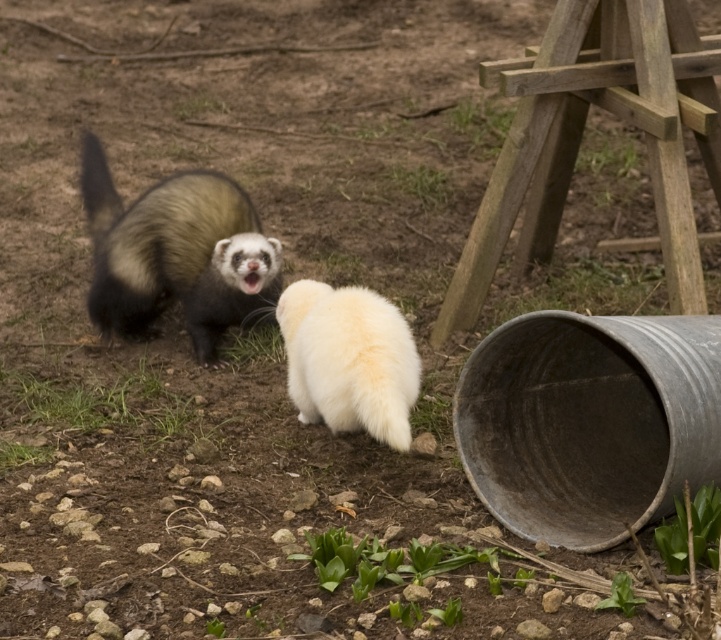
Does wooden at right have a larger size compared to fuzzy black and white ferret at upper left?

Correct, wooden at right is larger in size than fuzzy black and white ferret at upper left.

Between wooden at right and fuzzy black and white ferret at upper left, which one is positioned lower?

Positioned lower is fuzzy black and white ferret at upper left.

This screenshot has height=640, width=721. What do you see at coordinates (580, 134) in the screenshot? I see `wooden at right` at bounding box center [580, 134].

Find the location of a particular element. wooden at right is located at coordinates (580, 134).